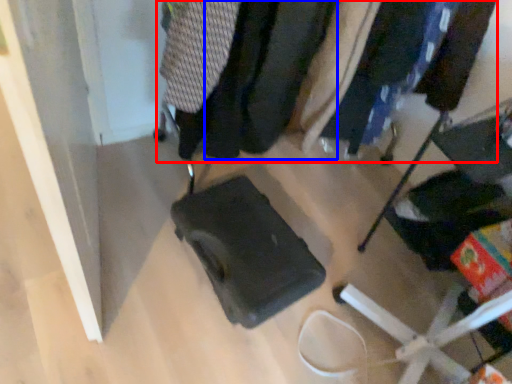
Question: Which object appears closest to the camera in this image, closet (highlighted by a red box) or clothing (highlighted by a blue box)?

Choices:
 (A) closet
 (B) clothing

Answer: (A)